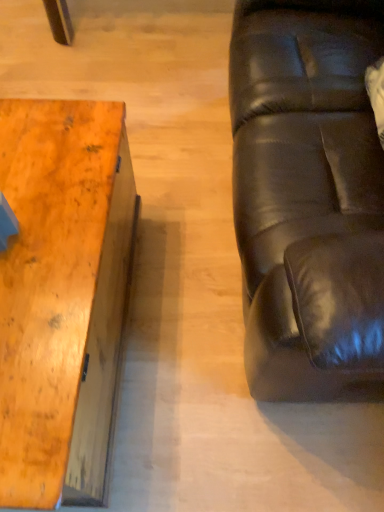
The image size is (384, 512). Find the location of `vacant region to the right of wooden table at left`. vacant region to the right of wooden table at left is located at coordinates (204, 352).